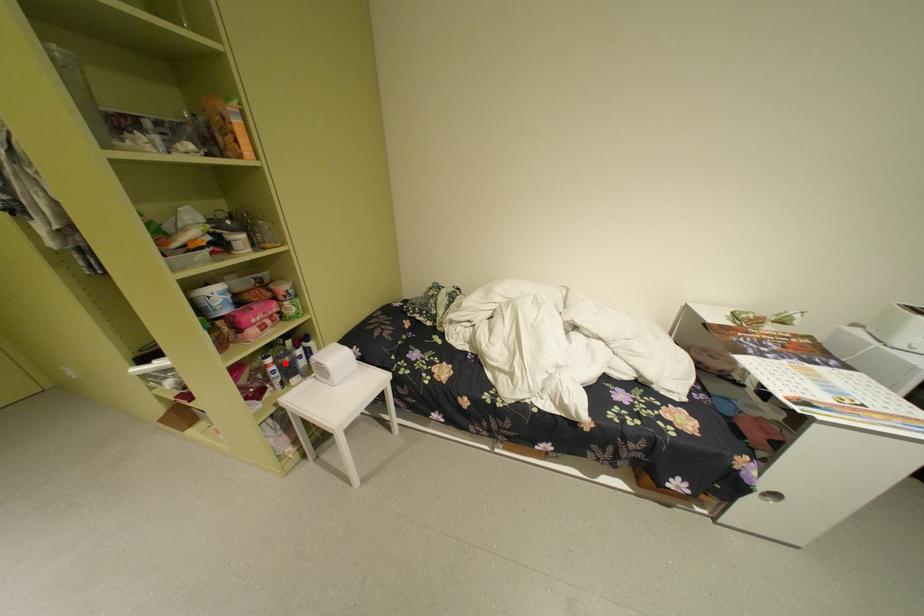
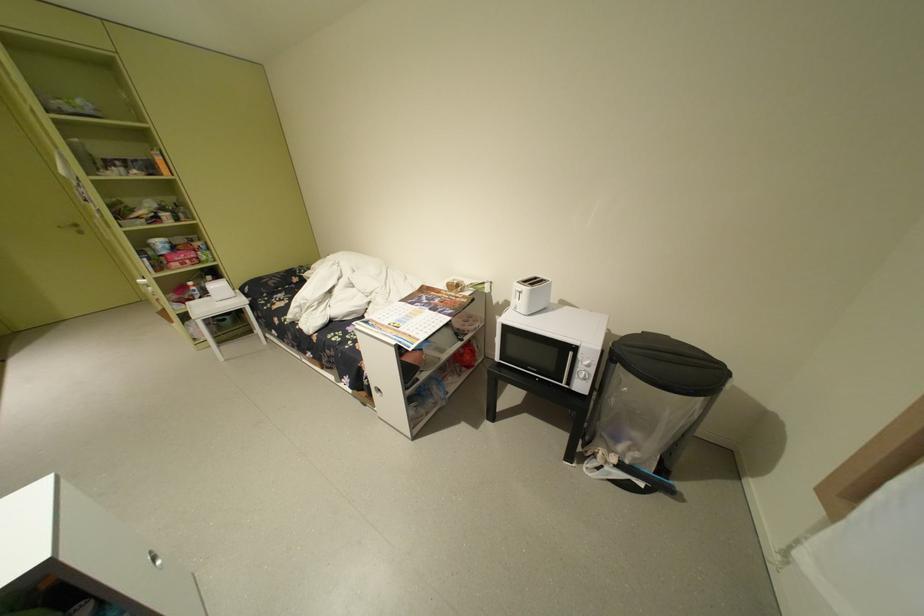
Locate, in the second image, the point that corresponds to the highlighted location in the first image.

(204, 286)